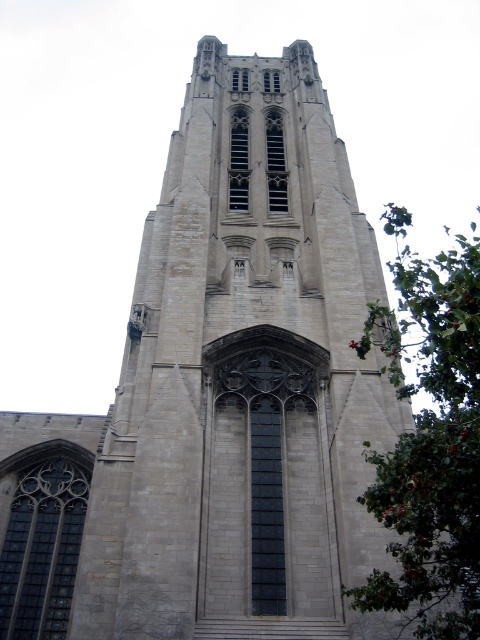
Question: Can you confirm if gray stone tower at center is smaller than green leafy tree at right?

Choices:
 (A) no
 (B) yes

Answer: (B)

Question: Is gray stone tower at center above green leafy tree at right?

Choices:
 (A) yes
 (B) no

Answer: (A)

Question: Which object appears farthest from the camera in this image?

Choices:
 (A) green leafy tree at right
 (B) gray stone tower at center

Answer: (B)

Question: Does gray stone tower at center have a greater width compared to green leafy tree at right?

Choices:
 (A) yes
 (B) no

Answer: (B)